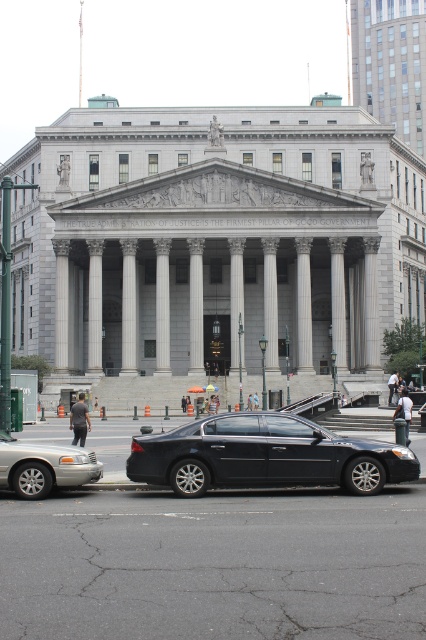
Question: Among these objects, which one is farthest from the camera?

Choices:
 (A) shiny black sedan at center
 (B) silver metallic sedan at lower left

Answer: (A)

Question: Does shiny black sedan at center lie behind silver metallic sedan at lower left?

Choices:
 (A) yes
 (B) no

Answer: (A)

Question: Considering the relative positions of shiny black sedan at center and silver metallic sedan at lower left in the image provided, where is shiny black sedan at center located with respect to silver metallic sedan at lower left?

Choices:
 (A) below
 (B) above

Answer: (B)

Question: Which point appears farthest from the camera in this image?

Choices:
 (A) (368, 483)
 (B) (80, 474)

Answer: (A)

Question: Can you confirm if shiny black sedan at center is thinner than silver metallic sedan at lower left?

Choices:
 (A) no
 (B) yes

Answer: (A)